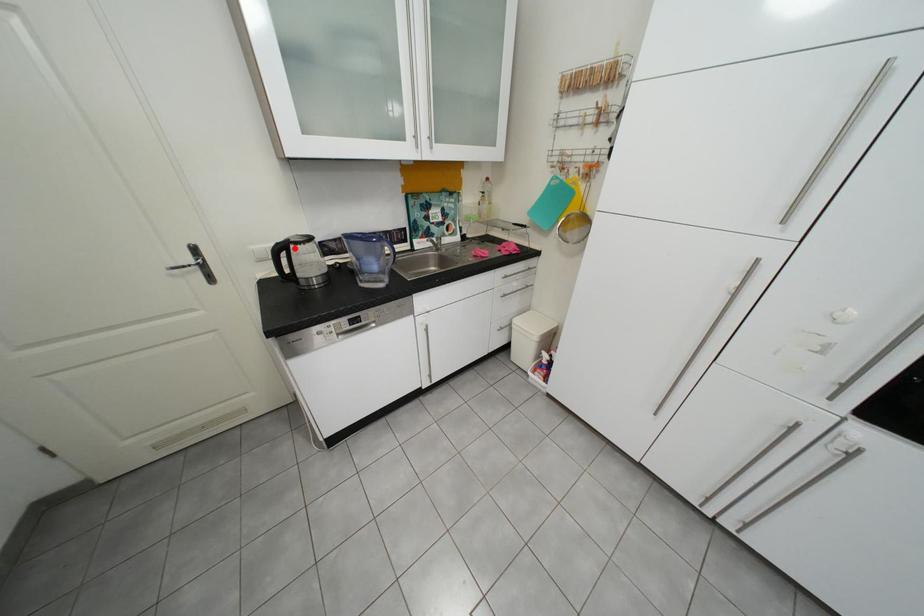
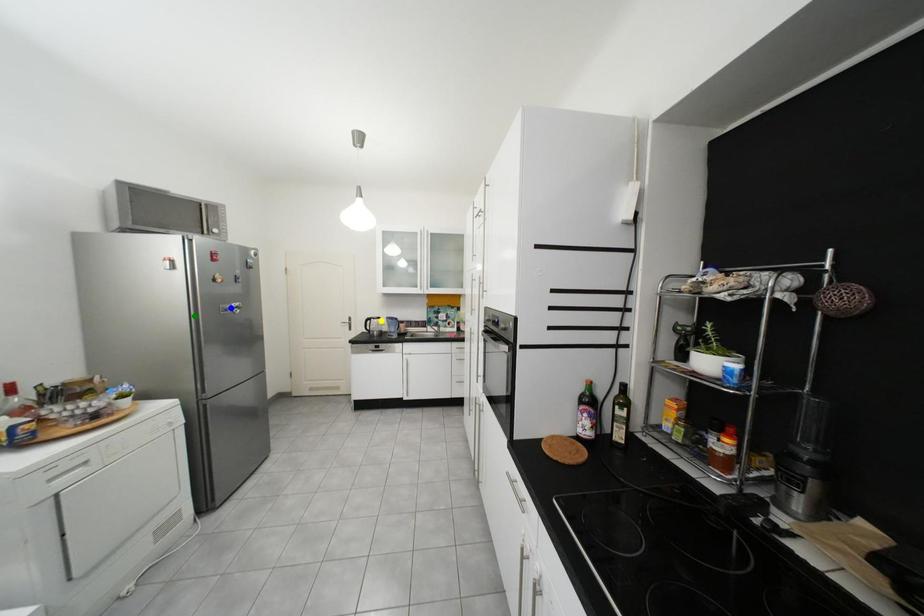
Question: I am providing you with two images of the same scene from different viewpoints. A red point is marked on the first image. You are given multiple points on the second image. Which spot in image 2 lines up with the point in image 1?

Choices:
 (A) blue point
 (B) yellow point
 (C) green point

Answer: (B)